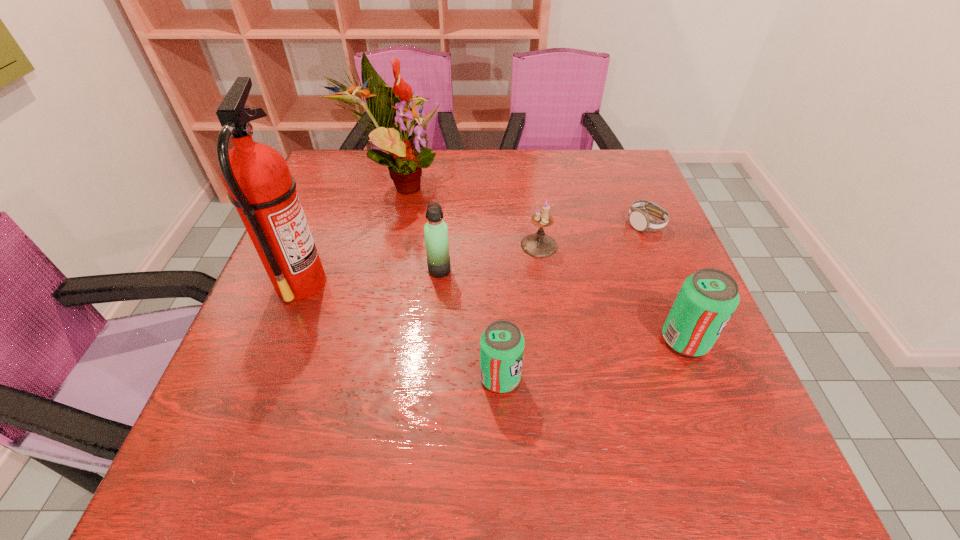
Given the evenly spaced pop sodas in the image, where should an extra pop soda be added on the left to preserve the spacing? Please point to a vacant space. Please provide its 2D coordinates. Your answer should be formatted as a tuple, i.e. [(x, y)], where the tuple contains the x and y coordinates of a point satisfying the conditions above.

[(287, 421)]